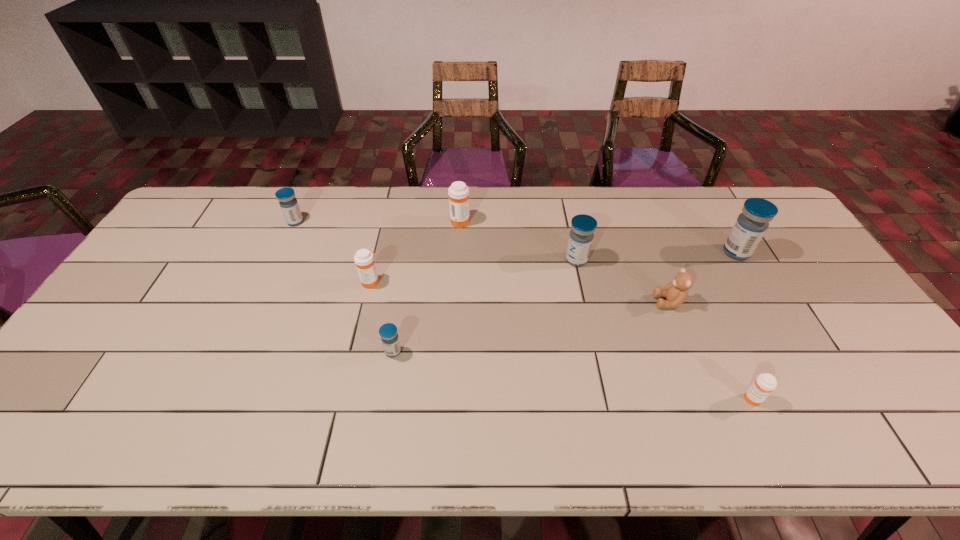
Where is `the rightmost blue medicine`? the rightmost blue medicine is located at coordinates (750, 226).

I want to click on the tallest object, so [750, 226].

You are a GUI agent. You are given a task and a screenshot of the screen. Output one action in this format:
    pyautogui.click(x=<x>, y=<y>)
    Task: Click on the biggest orange medicine
    The image size is (960, 540).
    Given the screenshot: What is the action you would take?
    pyautogui.click(x=458, y=192)

This screenshot has width=960, height=540. Identify the location of the fifth object from right to left. (458, 192).

The height and width of the screenshot is (540, 960). Identify the location of the third smallest blue medicine. (583, 226).

You are a GUI agent. You are given a task and a screenshot of the screen. Output one action in this format:
    pyautogui.click(x=<x>, y=<y>)
    Task: Click on the fifth medicine from left to right
    
    Given the screenshot: What is the action you would take?
    pyautogui.click(x=583, y=226)

Locate an element on the screen. The width and height of the screenshot is (960, 540). the farthest blue medicine is located at coordinates (289, 205).

This screenshot has width=960, height=540. I want to click on the leftmost blue medicine, so pyautogui.click(x=289, y=205).

Where is `the second farthest orange medicine`? The height and width of the screenshot is (540, 960). the second farthest orange medicine is located at coordinates (364, 259).

The image size is (960, 540). I want to click on the sixth medicine from right to left, so click(364, 259).